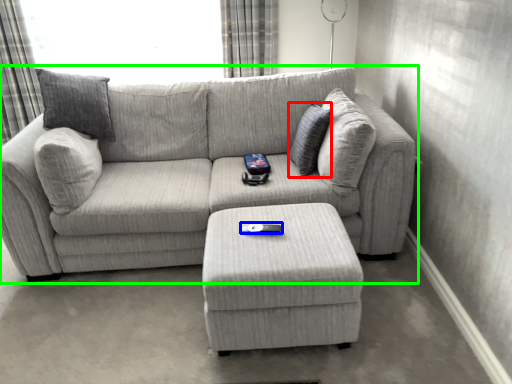
Question: Based on their relative distances, which object is farther from pillow (highlighted by a red box)? Choose from remote (highlighted by a blue box) and studio couch (highlighted by a green box).

Choices:
 (A) remote
 (B) studio couch

Answer: (A)